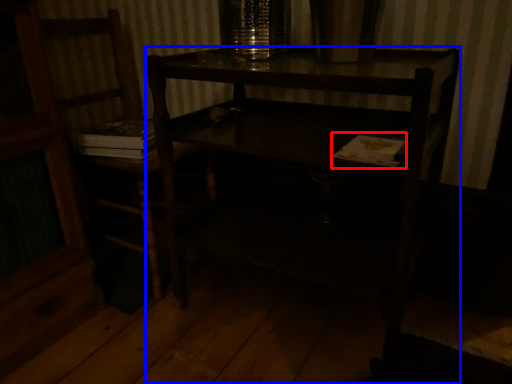
Question: Which object is closer to the camera taking this photo, book (highlighted by a red box) or desk (highlighted by a blue box)?

Choices:
 (A) book
 (B) desk

Answer: (B)